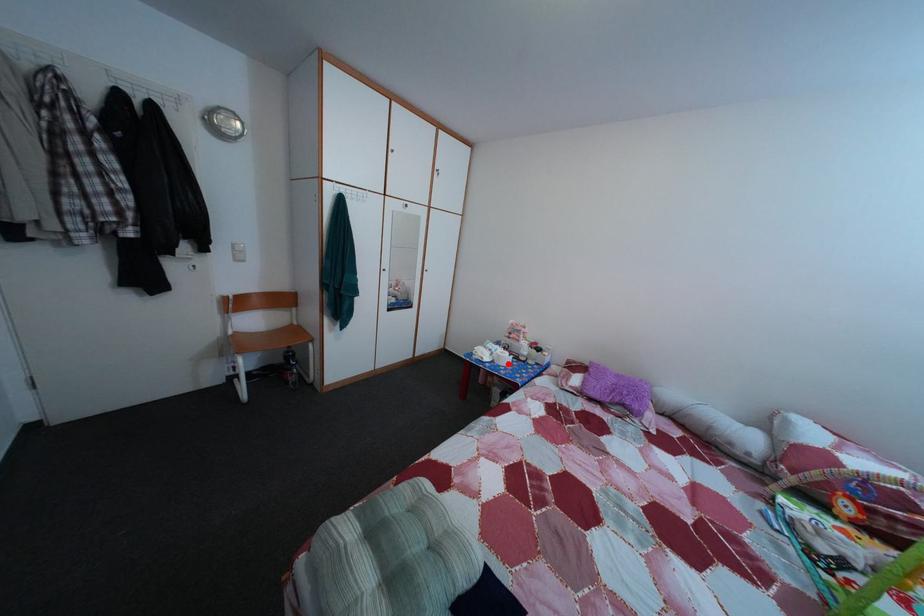
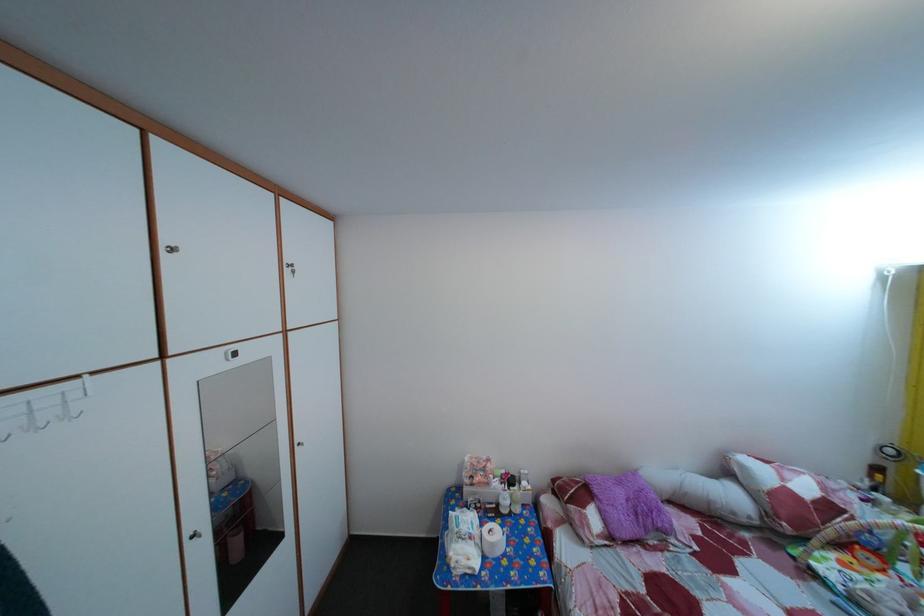
The point at the highlighted location is marked in the first image. Where is the corresponding point in the second image?

(502, 553)